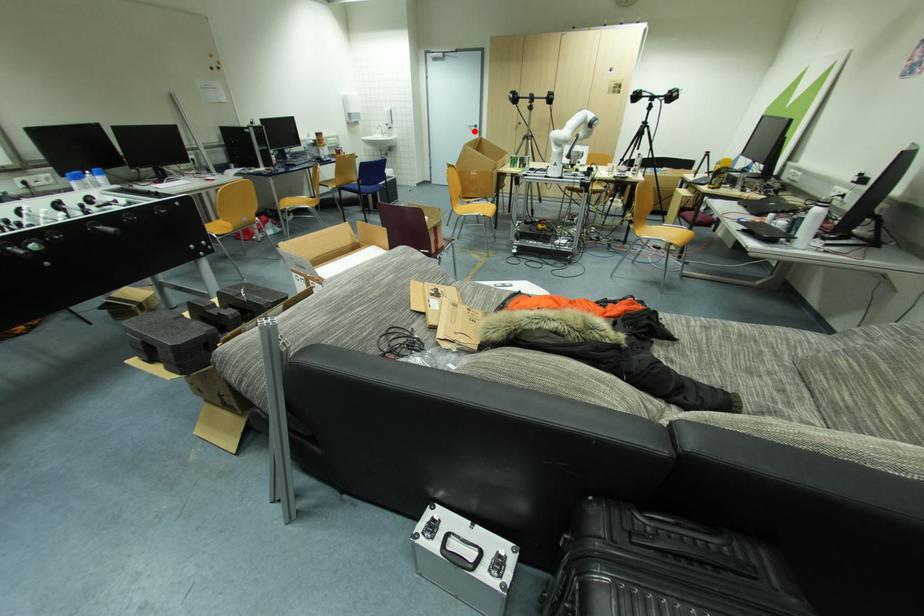
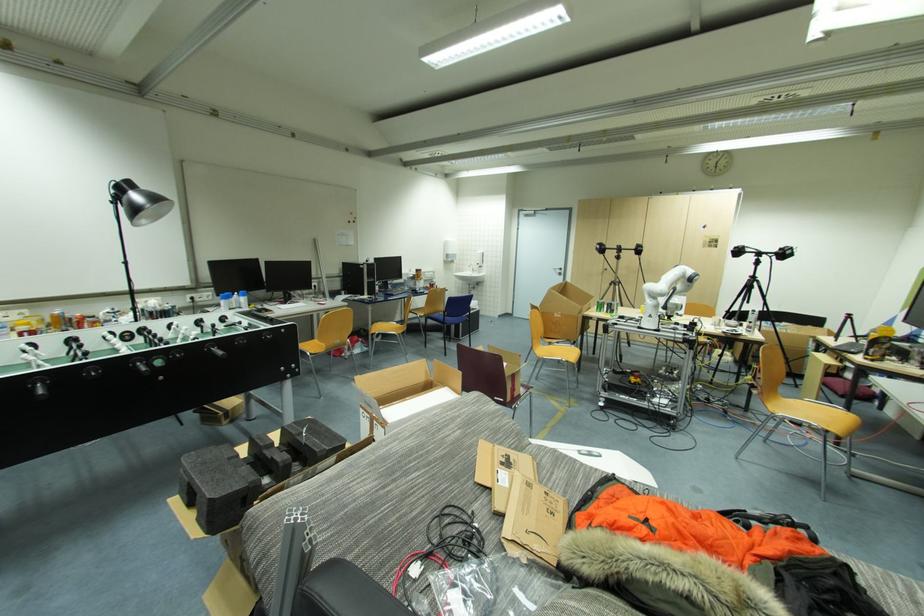
Question: I am providing you with two images of the same scene from different viewpoints. A red point is marked on the first image. At the location where the point appears in image 1, is it still visible in image 2?

Choices:
 (A) Yes
 (B) No

Answer: (A)